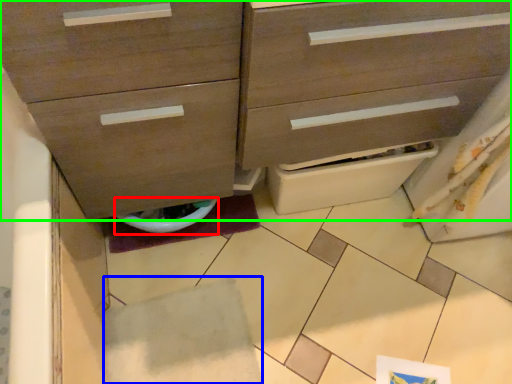
Question: Estimate the real-world distances between objects in this image. Which object is closer to toilet bowl (highlighted by a red box), tile (highlighted by a blue box) or chest of drawers (highlighted by a green box)?

Choices:
 (A) tile
 (B) chest of drawers

Answer: (A)